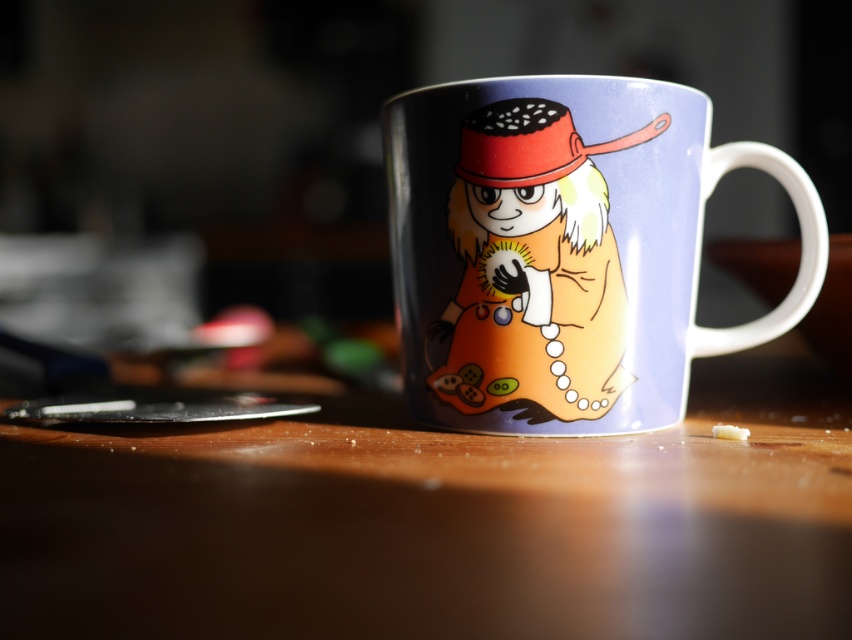
You are holding a pen and want to write a note on the wooden table at center. However, there is a glossy ceramic mug at center in the way. To the left or right of the mug should you move it to access the table surface?

The wooden table at center is positioned on the left side of the glossy ceramic mug at center, so you should move the glossy ceramic mug at center to the right to access the wooden table at center.

You are holding a 12 inch ruler and want to measure the distance between yourself and the wooden table at center. Can you reach it with the ruler without moving your hand?

The wooden table at center is 10.76 inches away from the viewer, so yes, the 12 inch ruler can reach it without moving your hand.

You are holding a small toy that needs to be placed on the wooden table at center or the glossy ceramic mug at center. Which object should you place it on to ensure it stays visible from the front of the scene?

The wooden table at center is in front of the glossy ceramic mug at center, so placing the toy on the wooden table at center will keep it visible from the front of the scene.